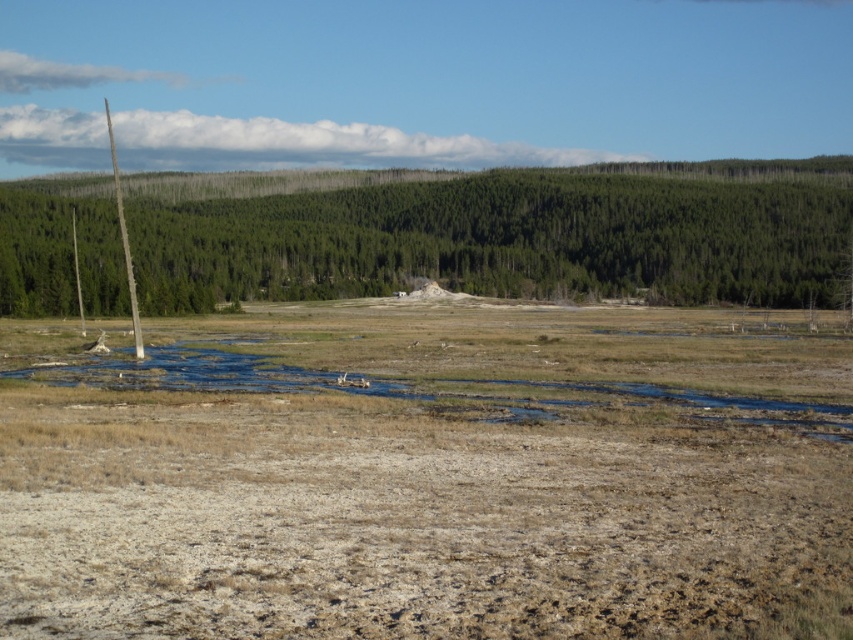
What do you see at coordinates (426, 476) in the screenshot? The width and height of the screenshot is (853, 640). I see `brown dry grass at center` at bounding box center [426, 476].

Who is taller, brown dry grass at center or brown wood pole at left?

Standing taller between the two is brown wood pole at left.

Is point (369, 449) positioned after point (593, 248)?

No.

Locate an element on the screen. The width and height of the screenshot is (853, 640). brown dry grass at center is located at coordinates (426, 476).